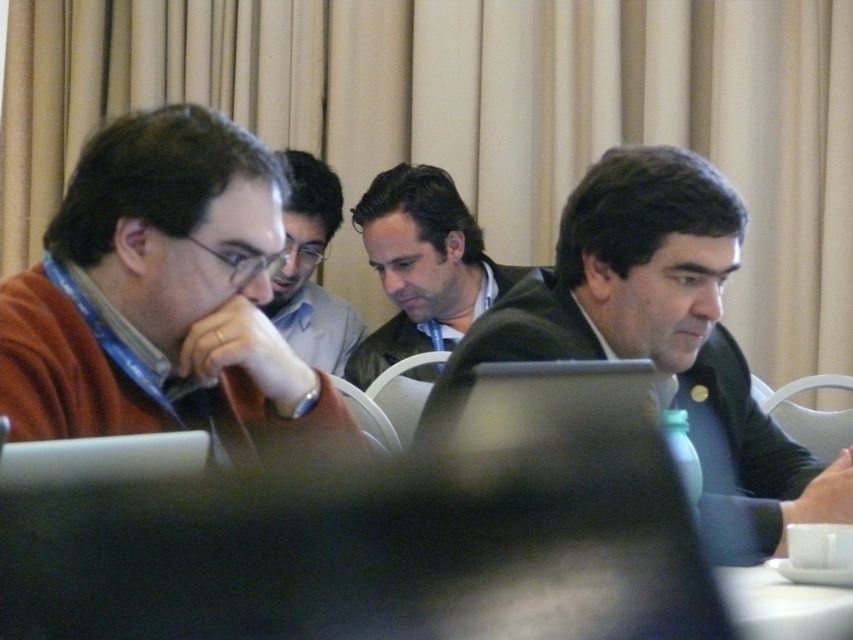
Who is lower down, dark brown leather jacket at center or matte black shirt at center?

dark brown leather jacket at center is below.

Does dark brown leather jacket at center appear on the right side of matte black shirt at center?

Yes, dark brown leather jacket at center is to the right of matte black shirt at center.

Is point (363, 362) positioned behind point (293, 300)?

No.

The image size is (853, 640). Find the location of `dark brown leather jacket at center`. dark brown leather jacket at center is located at coordinates (422, 266).

Which of these two, dark gray suit at right or matte black shirt at center, stands shorter?

dark gray suit at right

Identify the location of dark gray suit at right. (662, 337).

Is matte brown sweater at left to the left of dark gray suit at right from the viewer's perspective?

Yes, matte brown sweater at left is to the left of dark gray suit at right.

Which is more to the right, matte brown sweater at left or dark gray suit at right?

From the viewer's perspective, dark gray suit at right appears more on the right side.

Which is behind, point (79, 353) or point (616, 300)?

Positioned behind is point (616, 300).

The width and height of the screenshot is (853, 640). What are the coordinates of `matte brown sweater at left` in the screenshot? It's located at (165, 300).